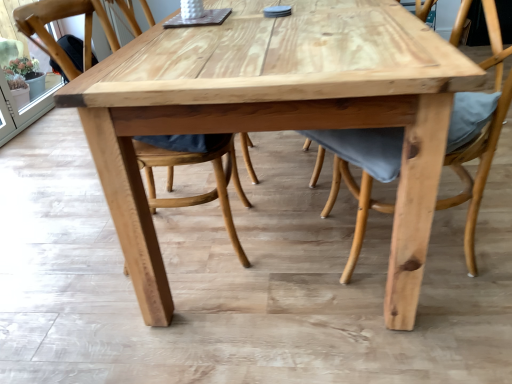
The width and height of the screenshot is (512, 384). In order to click on vacant space that is to the left of natural wood chair at center, which appears as the 2th chair when viewed from the right in this screenshot , I will do `click(59, 246)`.